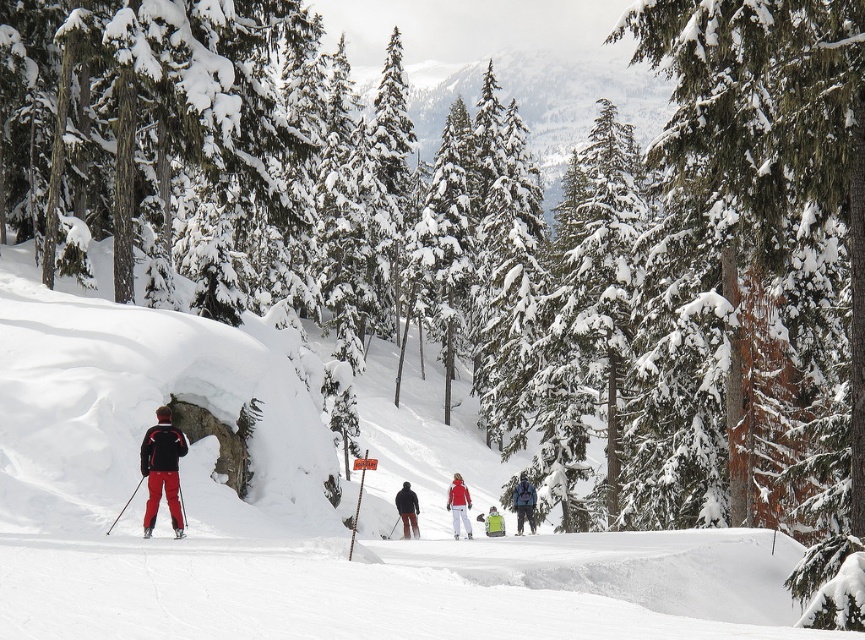
You are planning to place a small sign on the white snow ski slope at left and the green fabric backpack at center. Based on their positions, which object is higher up the slope?

The white snow ski slope at left is positioned over the green fabric backpack at center, so the white snow ski slope at left is higher up the slope.

You are a photographer positioned at the camera location. You want to capture a photo of the snow arch but need to ensure you are close enough to get a clear shot. The minimum focusing distance of your camera is 30 meters. Is the point at coordinates point (517, 516) within the camera focusing range?

The point at coordinates point (517, 516) is 37.51 meters from the camera. Since the minimum focusing distance is 30 meters, the camera can focus on the snow arch as the distance is within range.

You are a photographer trying to capture the snow arch in the middle ground. You notice a point at coordinates point [407,509] that might be blocking your view. Is this point part of the matte black jacket at center?

Yes, the point [407,509] corresponds to the matte black jacket at center, so it is blocking your view of the snow arch in the middle ground.